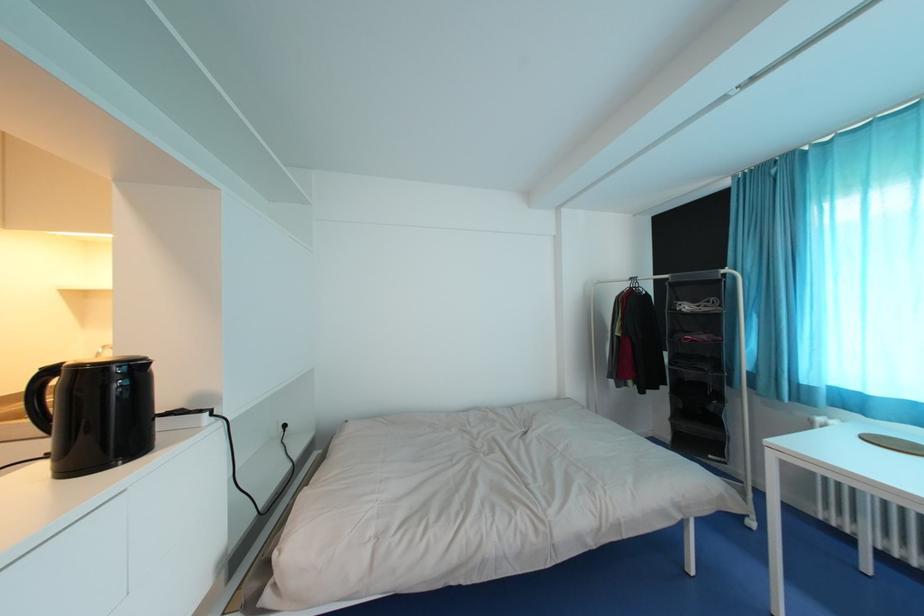
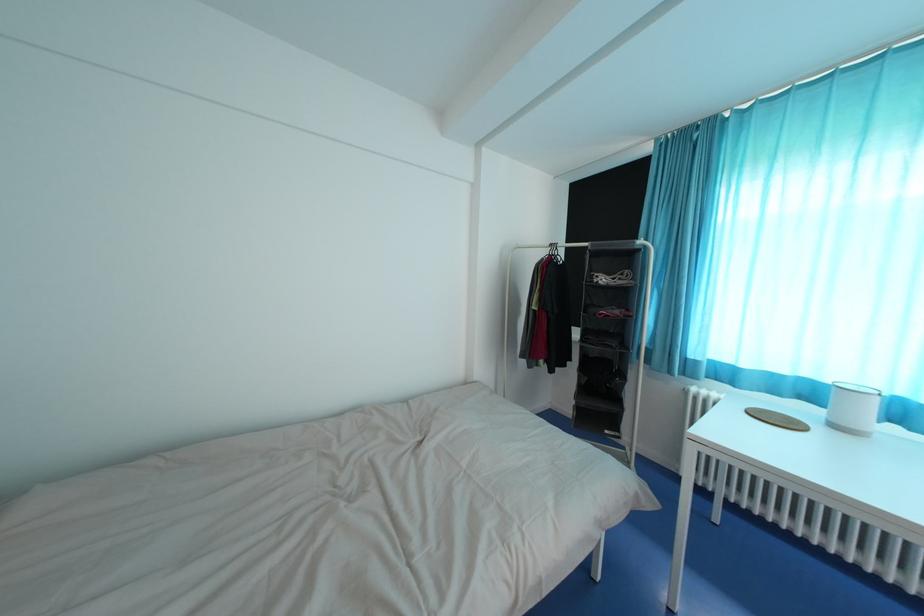
Question: The camera is either moving clockwise (left) or counter-clockwise (right) around the object. The first image is from the beginning of the video and the second image is from the end. Is the camera moving left or right when shooting the video?

Choices:
 (A) Left
 (B) Right

Answer: (A)